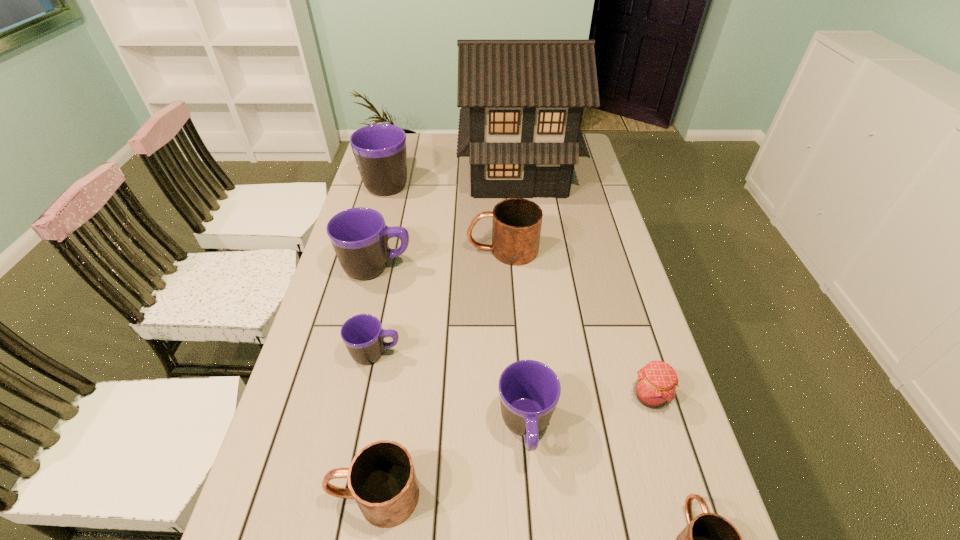
Identify the location of free space that satisfies the following two spatial constraints: 1. on the back side of the jam; 2. on the side of the biggest rust mug with the handle. The height and width of the screenshot is (540, 960). (606, 250).